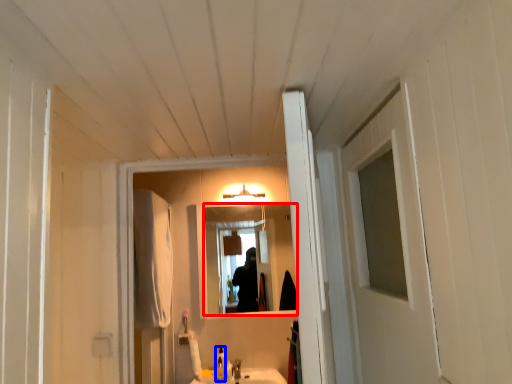
Question: Which object is further to the camera taking this photo, mirror (highlighted by a red box) or bottle (highlighted by a blue box)?

Choices:
 (A) mirror
 (B) bottle

Answer: (A)